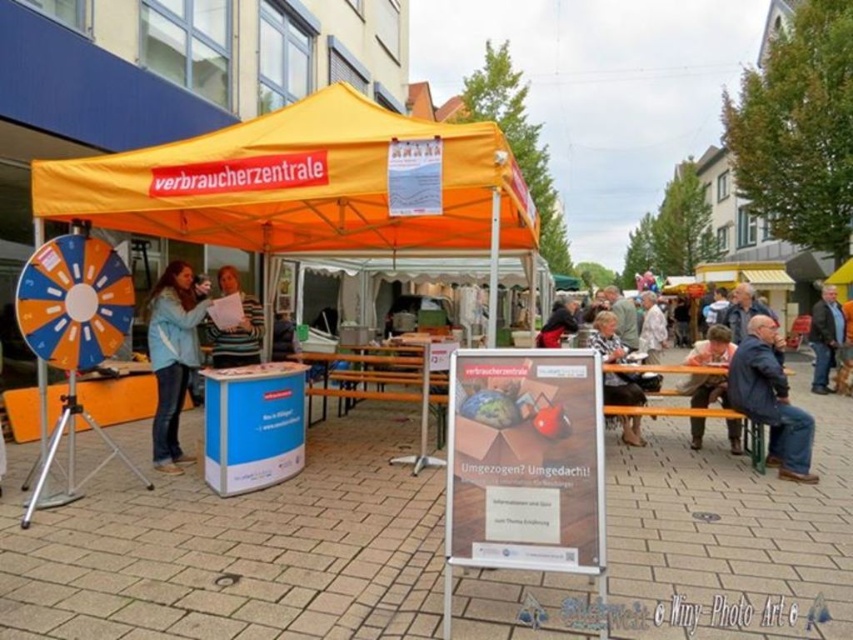
Question: Does dark brown leather jacket at right appear under light brown leather jacket at center?

Choices:
 (A) yes
 (B) no

Answer: (A)

Question: Does blue denim jacket at lower right appear over dark gray sweater at center?

Choices:
 (A) yes
 (B) no

Answer: (B)

Question: Which of the following is the farthest from the observer?

Choices:
 (A) (641, 323)
 (B) (184, 298)

Answer: (A)

Question: Which object appears closest to the camera in this image?

Choices:
 (A) blue denim jeans at lower right
 (B) light brown leather jacket at center
 (C) dark brown leather jacket at right

Answer: (A)

Question: Which object is positioned closest to the dark gray sweater at center?

Choices:
 (A) blue denim jacket at lower right
 (B) light brown leather jacket at center
 (C) orange fabric canopy at center
 (D) light blue denim jacket at center

Answer: (B)

Question: Can you confirm if blue denim jacket at lower right is positioned to the right of dark gray sweater at center?

Choices:
 (A) no
 (B) yes

Answer: (B)